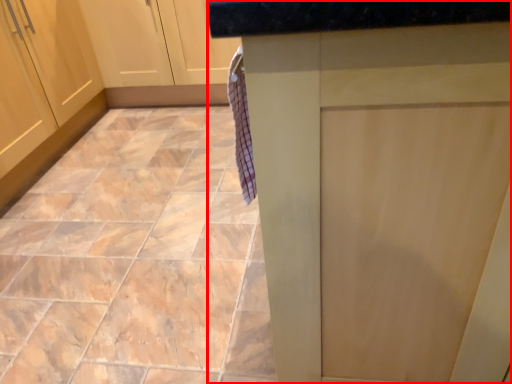
Question: From the image's perspective, where is counter (annotated by the red box) located in relation to ceramic tile in the image?

Choices:
 (A) above
 (B) below

Answer: (B)